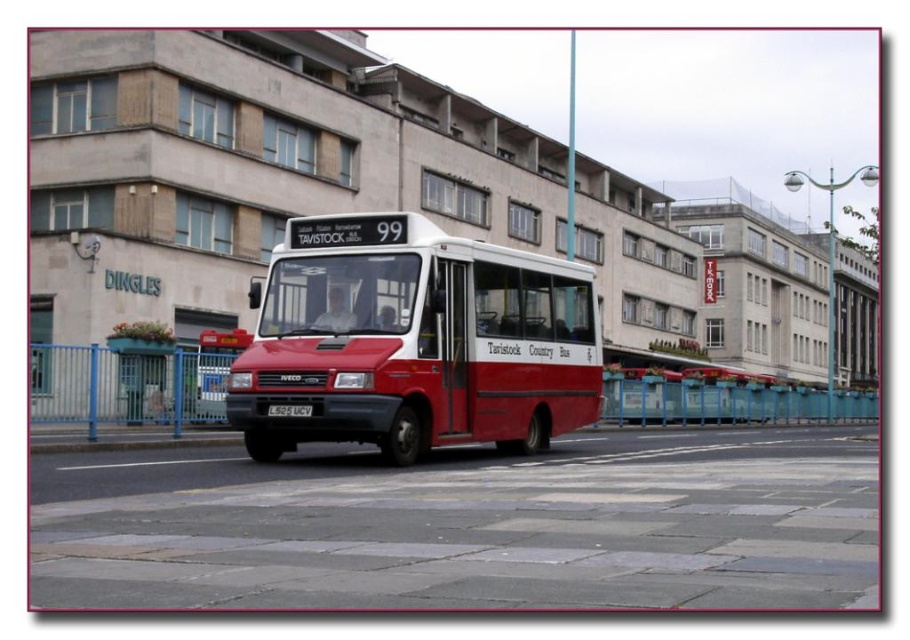
You are a photographer trying to capture the entire matte red bus at center and the black plastic license plate at center in one shot. Considering their sizes, which object will require you to adjust your camera to a wider angle to ensure both are fully visible?

The matte red bus at center is larger in size than the black plastic license plate at center, so you will need to adjust your camera to a wider angle to ensure the larger bus fits while still capturing the smaller license plate.

You are standing in front of the bus and want to determine the distance between two points on the bus. The first point is at coordinate point (546, 360) and the second is at point (301, 413). Which point is closer to you?

Point (546, 360) is further to the viewer than point (301, 413), so the second point is closer to you.